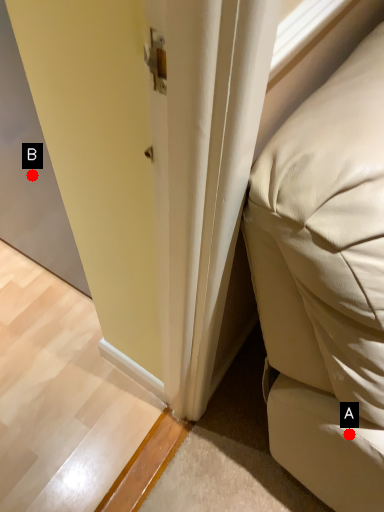
Question: Two points are circled on the image, labeled by A and B beside each circle. Which point is closer to the camera?

Choices:
 (A) A is closer
 (B) B is closer

Answer: (A)